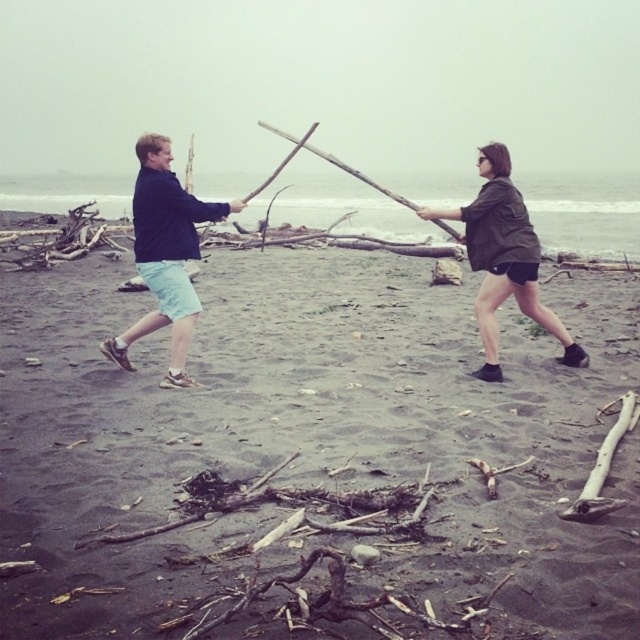
You are a photographer trying to capture the two people in the scene. To ensure the dark sand driftwood at center is perfectly centered in your shot, where should you aim your camera? Please provide coordinates based on the image grid system where the bottom left corner is the origin point.

The dark sand driftwood at center is located at coordinates [307,449], so you should aim your camera at that point to center it in your shot.

You are a photographer trying to capture a closeup of the matte green jacket at center while also including the dark sand driftwood at center in the frame. Given that your camera has a maximum focus range of 6 feet, will you be able to achieve this shot?

The dark sand driftwood at center is 6.17 feet from the matte green jacket at center. Since the distance between them exceeds the camera maximum focus range of 6 feet, you won be able to capture both in focus simultaneously.

You are standing on the beach in the image and want to find the point marked at coordinates (307, 449). Where should you look?

The point marked at coordinates (307, 449) is located on the dark sand driftwood at center.